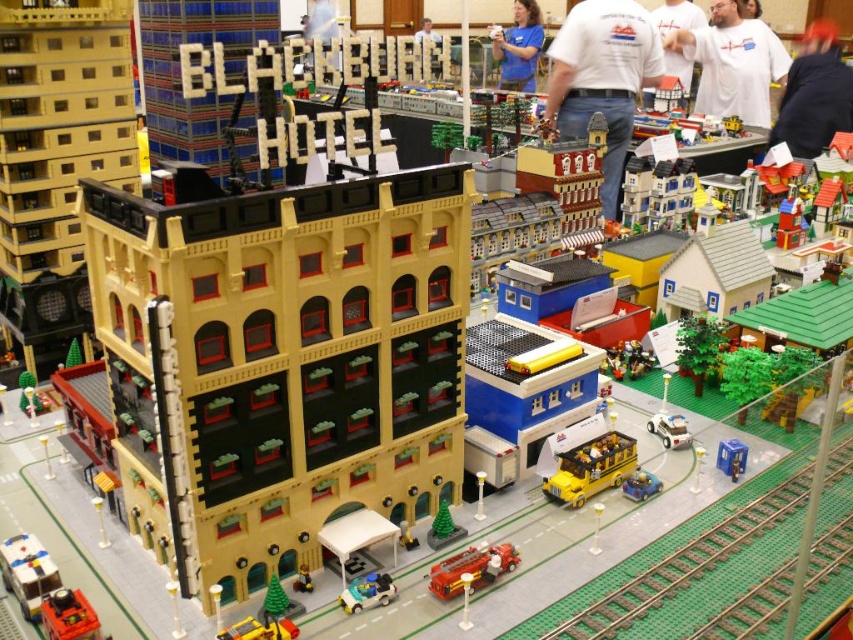
You are a delivery drone flying over the Lego city. You need to deliver a package to the point at coordinates point (648,596). However, there is an obstacle at point (85,611). Can you safely fly over the obstacle to reach your destination?

Point (648,596) is behind point (85,611), so the delivery drone can safely fly over the obstacle at point (85,611) to reach the destination at point (648,596).

Consider the image. You are a passenger waiting at the Lego train station. You see the green textured train track at lower right and the shiny black train at lower left. Which object is positioned higher in the scene?

The green textured train track at lower right is positioned higher than the shiny black train at lower left because it is above it.

You are a delivery person trying to locate the white plastic ambulance at lower left in the Lego city. According to the map coordinates, where is it positioned?

The white plastic ambulance at lower left is positioned at point (27, 572).